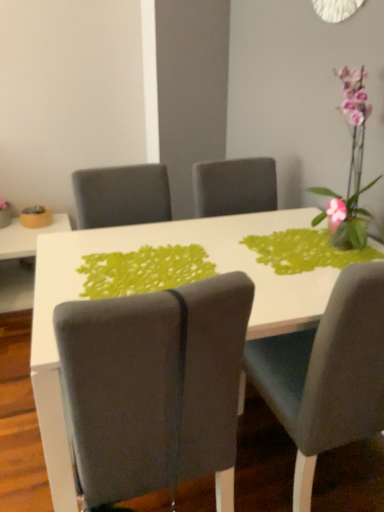
This screenshot has height=512, width=384. Find the location of `free spot above white glossy table at lower left, the first table positioned from the left (from a real-world perspective)`. free spot above white glossy table at lower left, the first table positioned from the left (from a real-world perspective) is located at coordinates (21, 231).